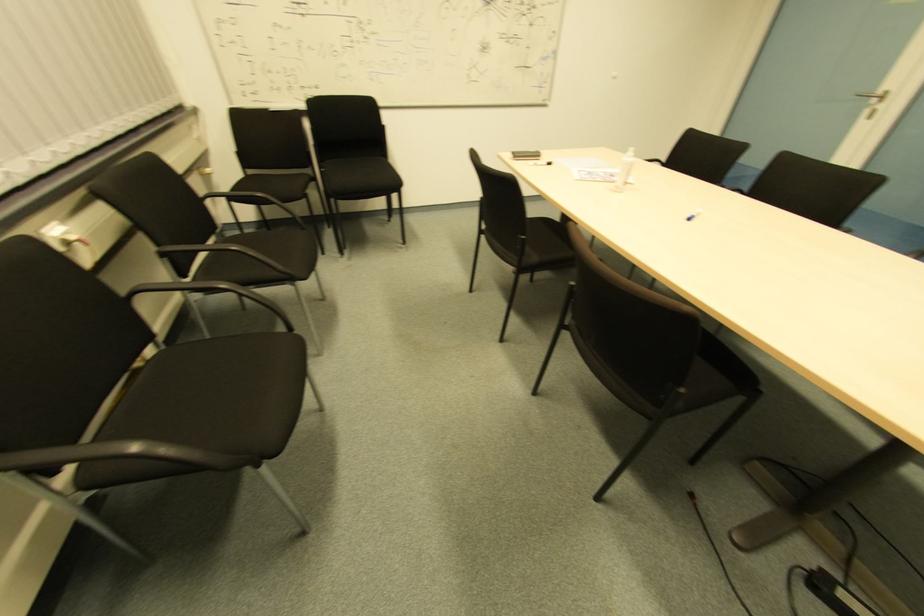
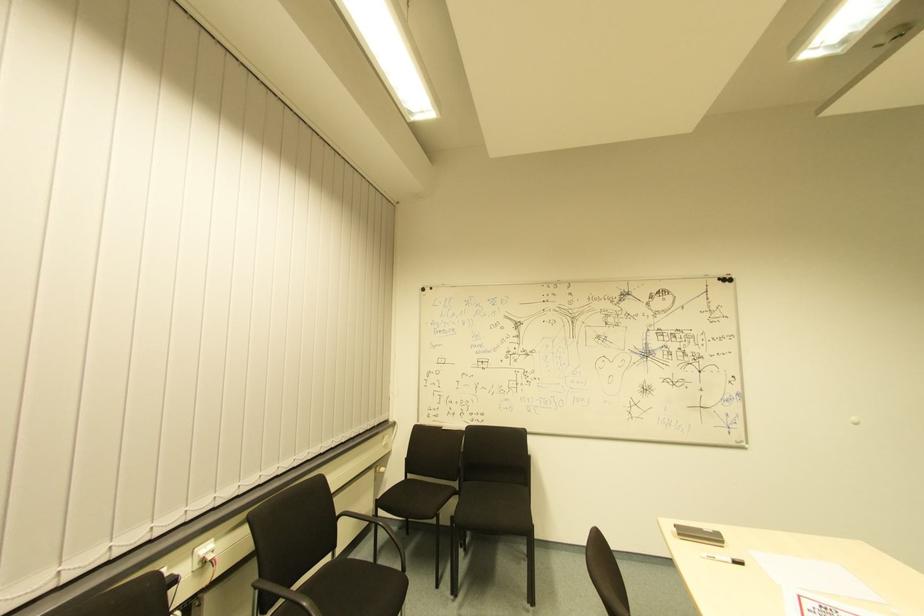
The images are taken continuously from a first-person perspective. In which direction is your viewpoint rotating?

The camera rotated toward left-up.